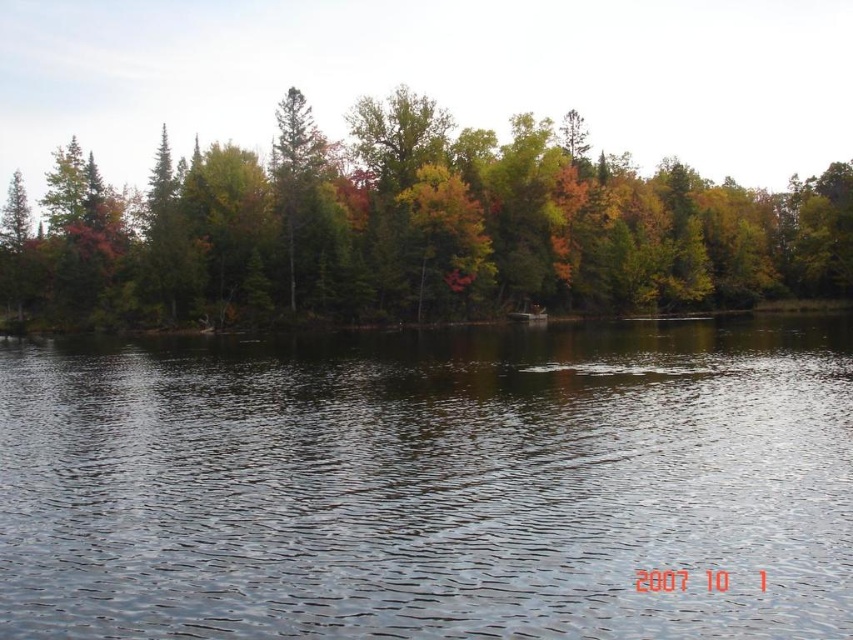
Question: Does transparent water at center appear on the left side of green matte tree at center?

Choices:
 (A) yes
 (B) no

Answer: (B)

Question: Among these points, which one is nearest to the camera?

Choices:
 (A) 267,598
 (B) 404,212

Answer: (A)

Question: Which point appears farthest from the camera in this image?

Choices:
 (A) (253, 621)
 (B) (786, 243)

Answer: (B)

Question: Is transparent water at center in front of green matte tree at center?

Choices:
 (A) no
 (B) yes

Answer: (B)

Question: Does transparent water at center have a greater width compared to green matte tree at center?

Choices:
 (A) yes
 (B) no

Answer: (B)